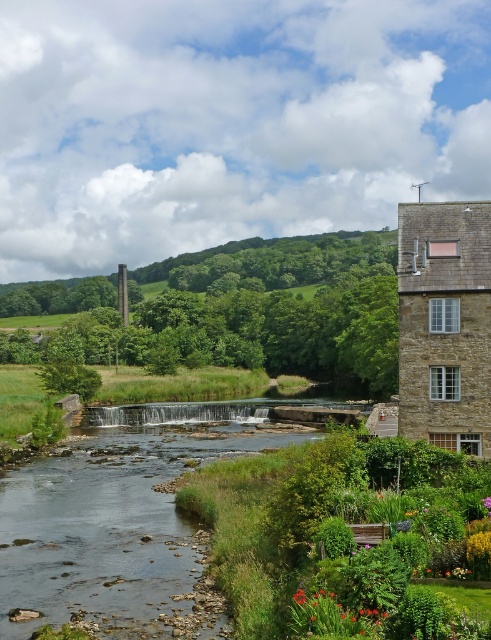
Question: Can you confirm if green leafy garden at lower right is wider than clear water at center?

Choices:
 (A) yes
 (B) no

Answer: (B)

Question: Which point is farther from the camera taking this photo?

Choices:
 (A) (384, 454)
 (B) (59, 502)

Answer: (B)

Question: Is green leafy garden at lower right to the right of clear water at center from the viewer's perspective?

Choices:
 (A) yes
 (B) no

Answer: (A)

Question: Does green leafy garden at lower right appear on the right side of clear water at center?

Choices:
 (A) no
 (B) yes

Answer: (B)

Question: Which point appears farthest from the camera in this image?

Choices:
 (A) (413, 566)
 (B) (87, 525)

Answer: (B)